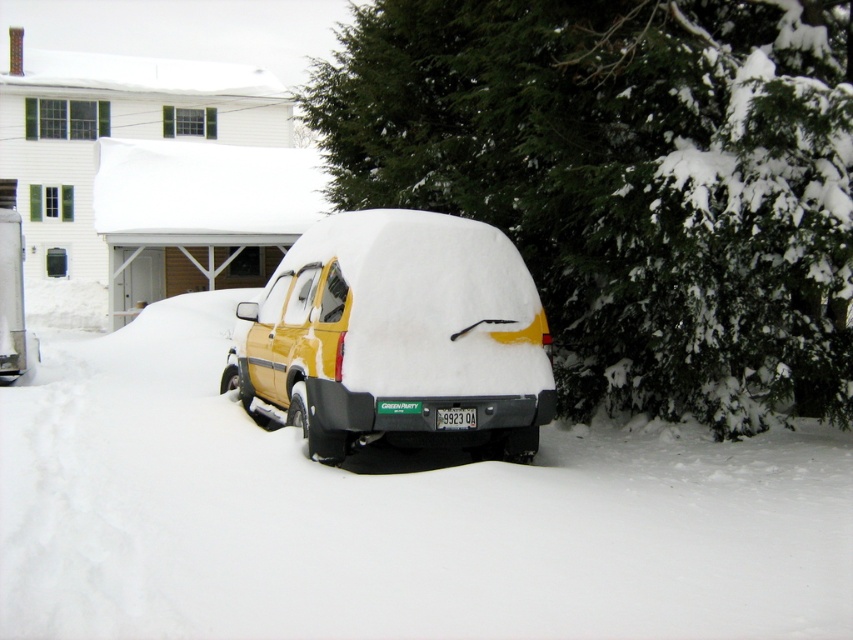
Does white fluffy snow at center have a larger size compared to yellow matte van at center?

Correct, white fluffy snow at center is larger in size than yellow matte van at center.

Describe the element at coordinates (389, 516) in the screenshot. I see `white fluffy snow at center` at that location.

What do you see at coordinates (389, 516) in the screenshot? I see `white fluffy snow at center` at bounding box center [389, 516].

You are a GUI agent. You are given a task and a screenshot of the screen. Output one action in this format:
    pyautogui.click(x=<x>, y=<y>)
    Task: Click on the white fluffy snow at center
    Image resolution: width=853 pixels, height=640 pixels.
    Given the screenshot: What is the action you would take?
    pyautogui.click(x=389, y=516)